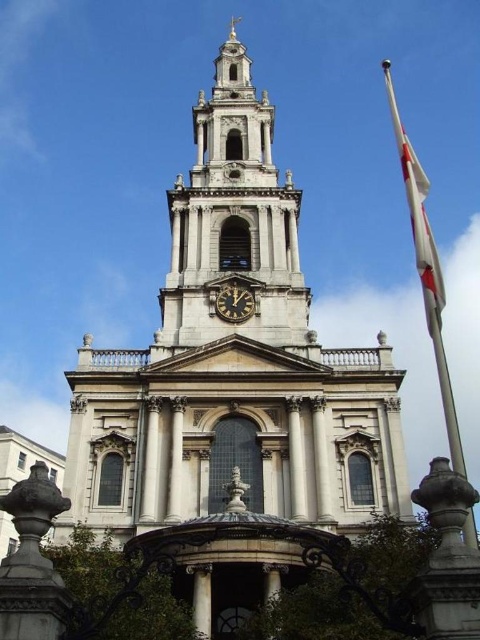
You are an architect analyzing the building facade. You notice the white fabric flag at upper right and the black polished clock at center. Which object is positioned closer to the front of the facade?

The white fabric flag at upper right is closer to the viewer than the black polished clock at center, so it is positioned closer to the front of the facade.

You are a tourist standing in front of the grand historic building. You see the smooth stone clock tower at center and the black polished clock at center. Which one is positioned higher up on the building?

The smooth stone clock tower at center is located above the black polished clock at center, so it is positioned higher up on the building.

You are a maintenance worker who needs to replace the flagpole. The flagpole currently holds the white fabric flag at upper right. The black polished clock at center is nearby. Which object is wider so that you can determine the required replacement pole size?

The white fabric flag at upper right might be wider than black polished clock at center, so you should choose a pole that can accommodate the width of the white fabric flag at upper right to ensure it fits properly.